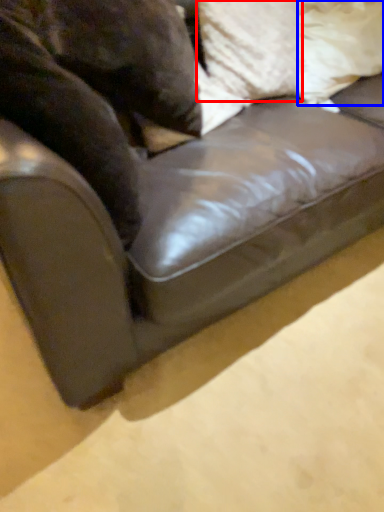
Question: Which object is closer to the camera taking this photo, pillow (highlighted by a red box) or pillow (highlighted by a blue box)?

Choices:
 (A) pillow
 (B) pillow

Answer: (A)